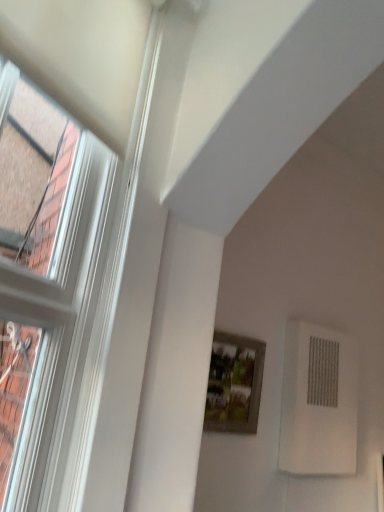
I want to click on wooden framed picture at center, so click(234, 384).

What do you see at coordinates (234, 384) in the screenshot? I see `wooden framed picture at center` at bounding box center [234, 384].

Based on the photo, measure the distance between white textured air conditioning unit at lower right and camera.

white textured air conditioning unit at lower right is 5.53 feet from camera.

The height and width of the screenshot is (512, 384). I want to click on white textured air conditioning unit at lower right, so click(x=318, y=402).

Image resolution: width=384 pixels, height=512 pixels. Describe the element at coordinates (318, 402) in the screenshot. I see `white textured air conditioning unit at lower right` at that location.

You are a GUI agent. You are given a task and a screenshot of the screen. Output one action in this format:
    pyautogui.click(x=<x>, y=<y>)
    Task: Click on the wooden framed picture at center
    
    Given the screenshot: What is the action you would take?
    pyautogui.click(x=234, y=384)

Is white textured air conditioning unit at lower right at the right side of wooden framed picture at center?

Yes, white textured air conditioning unit at lower right is to the right of wooden framed picture at center.

Is white textured air conditioning unit at lower right further to the viewer compared to wooden framed picture at center?

Yes, white textured air conditioning unit at lower right is further from the camera.

Which is in front, point (281, 460) or point (257, 409)?

Point (281, 460)

From the image's perspective, is white textured air conditioning unit at lower right located above wooden framed picture at center?

No, from the image's perspective, white textured air conditioning unit at lower right is not over wooden framed picture at center.

From a real-world perspective, which object rests below the other?

wooden framed picture at center.

Consider the image. Considering the sizes of objects white textured air conditioning unit at lower right and wooden framed picture at center in the image provided, who is thinner, white textured air conditioning unit at lower right or wooden framed picture at center?

Thinner between the two is wooden framed picture at center.

In terms of height, does white textured air conditioning unit at lower right look taller or shorter compared to wooden framed picture at center?

In the image, white textured air conditioning unit at lower right appears to be taller than wooden framed picture at center.

Does white textured air conditioning unit at lower right have a larger size compared to wooden framed picture at center?

Yes.

Is wooden framed picture at center inside white textured air conditioning unit at lower right?

No, white textured air conditioning unit at lower right does not contain wooden framed picture at center.

Is white textured air conditioning unit at lower right in contact with wooden framed picture at center?

white textured air conditioning unit at lower right and wooden framed picture at center are not in contact.

Is white textured air conditioning unit at lower right looking in the opposite direction of wooden framed picture at center?

No, wooden framed picture at center is not at the back of white textured air conditioning unit at lower right.

I want to click on air conditioning on the right of wooden framed picture at center, so click(x=318, y=402).

Considering the positions of objects wooden framed picture at center and white textured air conditioning unit at lower right in the image provided, who is more to the right, wooden framed picture at center or white textured air conditioning unit at lower right?

From the viewer's perspective, white textured air conditioning unit at lower right appears more on the right side.

Which object is further away from the camera, wooden framed picture at center or white textured air conditioning unit at lower right?

white textured air conditioning unit at lower right is further away from the camera.

Does point (239, 407) appear closer or farther from the camera than point (332, 355)?

Clearly, point (239, 407) is closer to the camera than point (332, 355).

From the image's perspective, would you say wooden framed picture at center is shown under white textured air conditioning unit at lower right?

No, from the image's perspective, wooden framed picture at center is not beneath white textured air conditioning unit at lower right.

From a real-world perspective, is wooden framed picture at center over white textured air conditioning unit at lower right?

No, from a real-world perspective, wooden framed picture at center is not on top of white textured air conditioning unit at lower right.

Is wooden framed picture at center wider or thinner than white textured air conditioning unit at lower right?

In the image, wooden framed picture at center appears to be more narrow than white textured air conditioning unit at lower right.

Consider the image. Does wooden framed picture at center have a lesser height compared to white textured air conditioning unit at lower right?

Yes.

Can you confirm if wooden framed picture at center is smaller than white textured air conditioning unit at lower right?

Yes, wooden framed picture at center is smaller than white textured air conditioning unit at lower right.

Is wooden framed picture at center surrounding white textured air conditioning unit at lower right?

No, white textured air conditioning unit at lower right is not a part of wooden framed picture at center.

Is wooden framed picture at center not close to white textured air conditioning unit at lower right?

Actually, wooden framed picture at center and white textured air conditioning unit at lower right are a little close together.

Is wooden framed picture at center facing away from white textured air conditioning unit at lower right?

No.

Image resolution: width=384 pixels, height=512 pixels. I want to click on air conditioning on the right of the wooden framed picture at center, so click(x=318, y=402).

Locate an element on the screen. Image resolution: width=384 pixels, height=512 pixels. picture frame above the white textured air conditioning unit at lower right (from the image's perspective) is located at coordinates (234, 384).

You are a GUI agent. You are given a task and a screenshot of the screen. Output one action in this format:
    pyautogui.click(x=<x>, y=<y>)
    Task: Click on the picture frame in front of the white textured air conditioning unit at lower right
    The height and width of the screenshot is (512, 384).
    Given the screenshot: What is the action you would take?
    pyautogui.click(x=234, y=384)